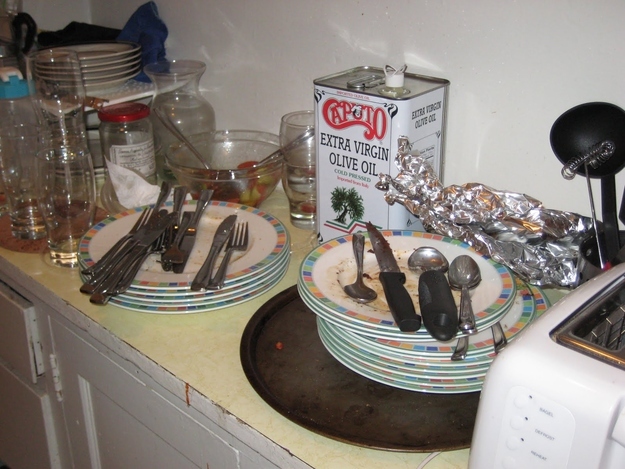
The image size is (625, 469). I want to click on spoon, so click(432, 254).